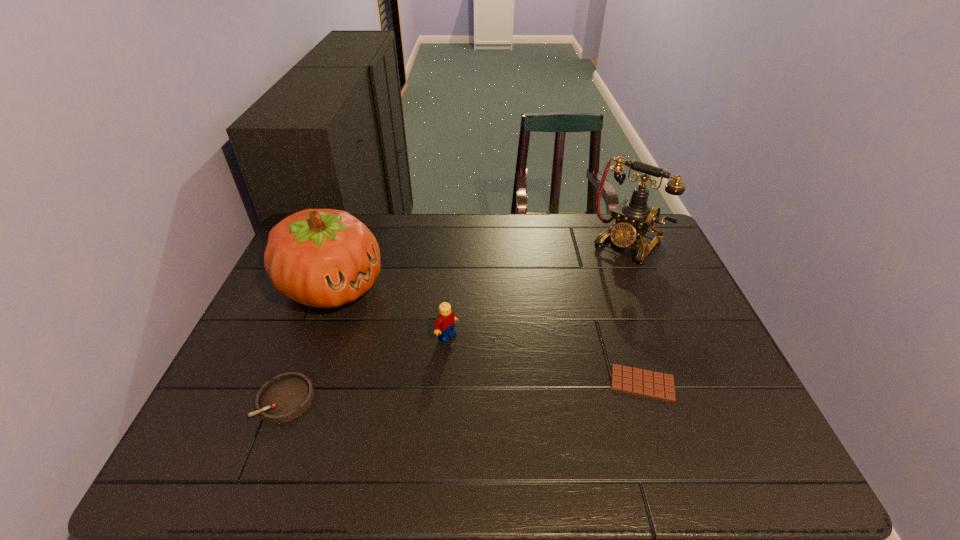
In the image, there is a desktop. At what (x,y) coordinates should I click in order to perform the action: click on free space at the near edge. Please return your answer as a coordinate pair (x, y). Image resolution: width=960 pixels, height=540 pixels. Looking at the image, I should click on (413, 411).

This screenshot has width=960, height=540. Find the location of `free space at the left edge of the desktop`. free space at the left edge of the desktop is located at coordinates (293, 313).

The height and width of the screenshot is (540, 960). What are the coordinates of `vacant space at the right edge` in the screenshot? It's located at (667, 364).

What are the coordinates of `free space at the far right corner of the desktop` in the screenshot? It's located at (637, 249).

Where is `vacant region at the near right corner of the desktop`? This screenshot has height=540, width=960. vacant region at the near right corner of the desktop is located at coordinates (750, 418).

Locate an element on the screen. empty location between the third farthest object and the fourth tallest object is located at coordinates (367, 368).

The image size is (960, 540). In order to click on free spot between the shortest object and the telephone in this screenshot , I will do `click(635, 314)`.

What are the coordinates of `vacant point located between the shortest object and the telephone` in the screenshot? It's located at (635, 314).

Image resolution: width=960 pixels, height=540 pixels. What are the coordinates of `free space that is in between the pumpkin and the telephone` in the screenshot? It's located at (480, 266).

Image resolution: width=960 pixels, height=540 pixels. Find the location of `free point between the pumpkin and the telephone`. free point between the pumpkin and the telephone is located at coordinates (480, 266).